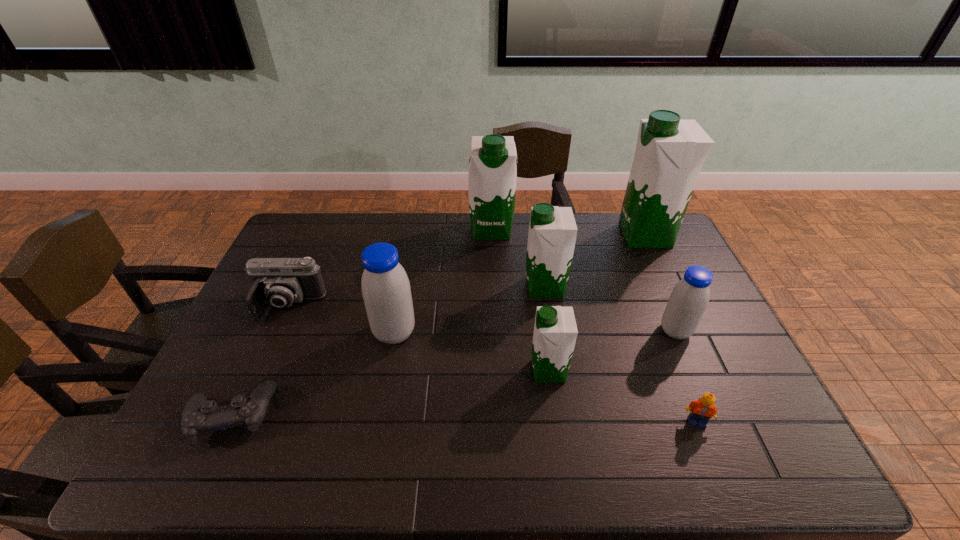
The height and width of the screenshot is (540, 960). In order to click on object at the near edge in this screenshot , I will do `click(199, 416)`.

Locate an element on the screen. The image size is (960, 540). camera that is positioned at the left edge is located at coordinates (279, 282).

Locate an element on the screen. The width and height of the screenshot is (960, 540). control at the left edge is located at coordinates (199, 416).

Locate an element on the screen. Lego that is at the right edge is located at coordinates (703, 409).

Locate an element on the screen. This screenshot has height=540, width=960. object at the near left corner is located at coordinates (199, 416).

I want to click on object located at the far right corner, so click(x=670, y=152).

The width and height of the screenshot is (960, 540). Identify the location of free space at the far edge. (365, 213).

In the image, there is a desktop. Where is `free space at the near edge`? free space at the near edge is located at coordinates (487, 452).

The width and height of the screenshot is (960, 540). I want to click on free location at the far left corner of the desktop, so click(x=293, y=233).

In the image, there is a desktop. Where is `blank space at the far right corner`? Image resolution: width=960 pixels, height=540 pixels. blank space at the far right corner is located at coordinates (653, 250).